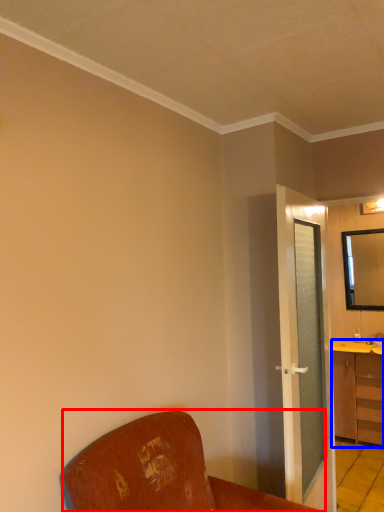
Question: Which object appears farthest to the camera in this image, furniture (highlighted by a red box) or cabinetry (highlighted by a blue box)?

Choices:
 (A) furniture
 (B) cabinetry

Answer: (B)